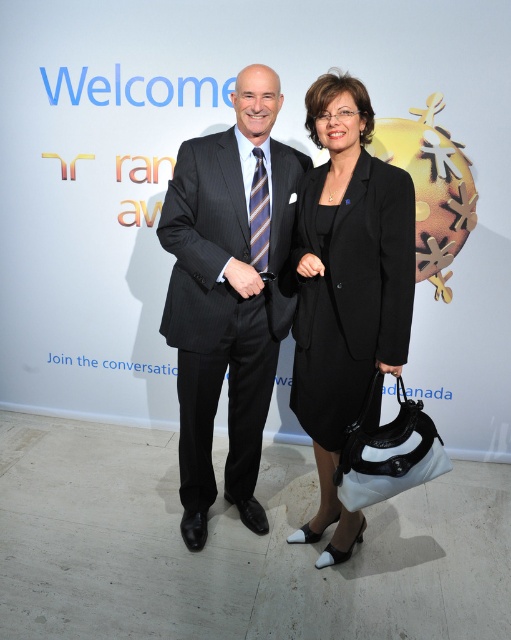
Between point (316, 228) and point (257, 204), which one is positioned behind?

The point (257, 204) is more distant.

This screenshot has height=640, width=511. What are the coordinates of `black leather dress at center` in the screenshot? It's located at (346, 289).

Which of these two, matte black suit at center or striped silk tie at center, stands taller?

matte black suit at center is taller.

This screenshot has height=640, width=511. In order to click on matte black suit at center in this screenshot , I will do `click(226, 298)`.

Is point (216, 294) positioned after point (336, 179)?

That is True.

Consider the image. Can you confirm if matte black suit at center is smaller than black leather dress at center?

Actually, matte black suit at center might be larger than black leather dress at center.

Does point (275, 332) lie in front of point (301, 228)?

No.

The height and width of the screenshot is (640, 511). Find the location of `matte black suit at center`. matte black suit at center is located at coordinates (226, 298).